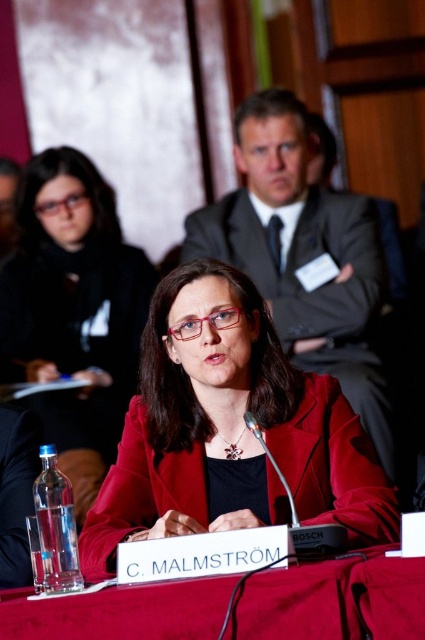
You are organizing a photo shoot and need to ensure that the two central figures in the image are framed properly. Given that the matte gray suit at center and the matte black jacket at center are both in the central area, which one should you focus on if you want to capture the broader silhouette?

The matte gray suit at center might be wider than the matte black jacket at center, so focusing on it would better capture the broader silhouette.

You are attending a conference and need to sit down. You see a matte gray suit at center and a smooth red table at center. Which object is closer to the right side of the room?

The matte gray suit at center is to the right of the smooth red table at center, so the matte gray suit at center is closer to the right side of the room.